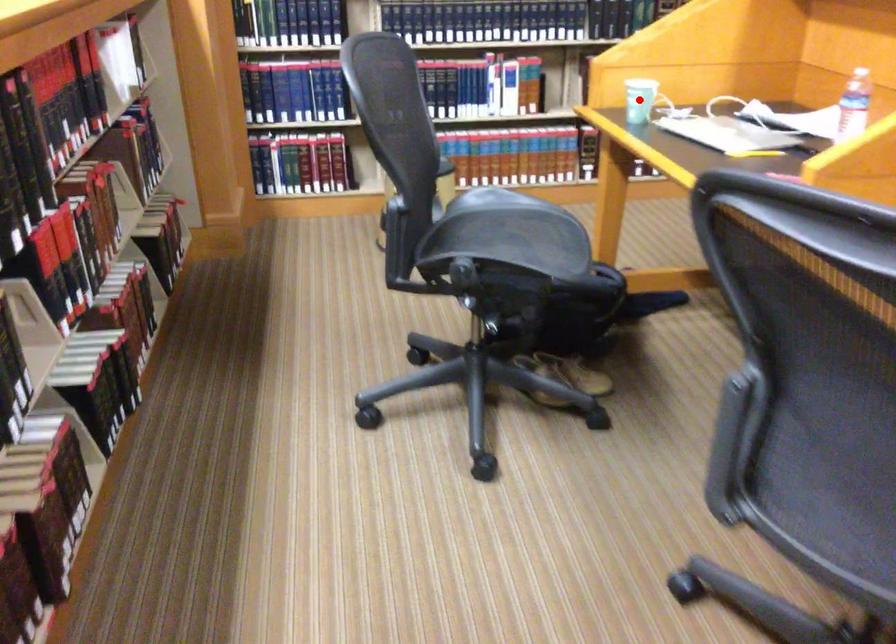
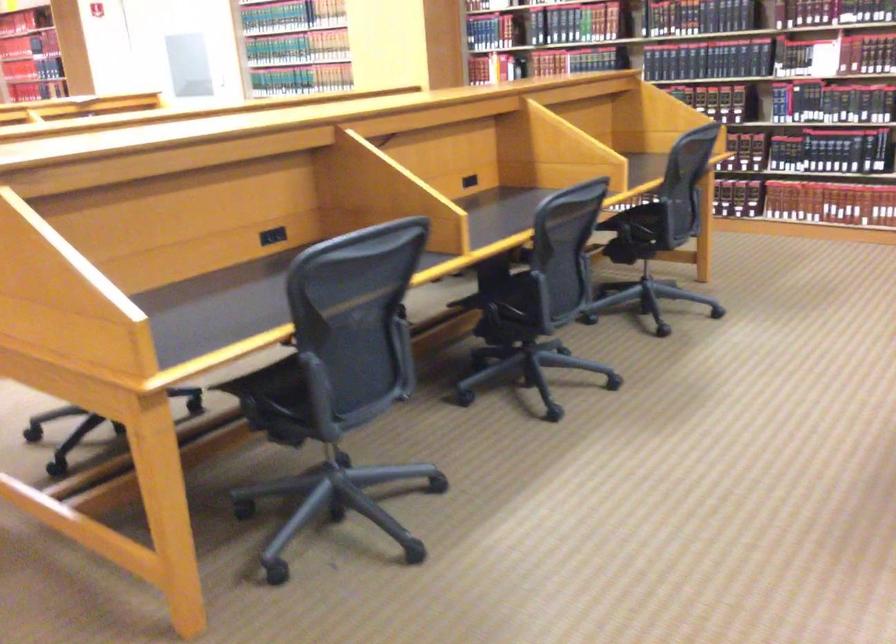
Question: I am providing you with two images of the same scene from different viewpoints. A red point is marked on the first image. At the location where the point appears in image 1, is it still visible in image 2?

Choices:
 (A) Yes
 (B) No

Answer: (B)